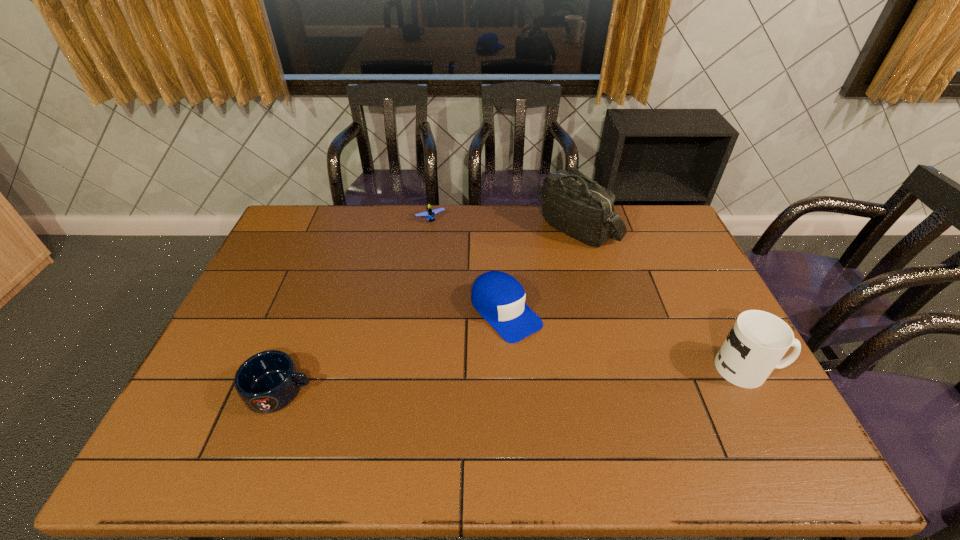
The image size is (960, 540). What are the coordinates of `shoulder bag at the far edge` in the screenshot? It's located at click(572, 203).

Locate an element on the screen. This screenshot has height=540, width=960. Lego at the far edge is located at coordinates (429, 214).

At what (x,y) coordinates should I click in order to perform the action: click on object at the near edge. Please return your answer as a coordinate pair (x, y). This screenshot has height=540, width=960. Looking at the image, I should click on (268, 381).

Identify the location of object that is positioned at the left edge. (268, 381).

You are a GUI agent. You are given a task and a screenshot of the screen. Output one action in this format:
    pyautogui.click(x=<x>, y=<y>)
    Task: Click on the object at the right edge
    The image size is (960, 540).
    Given the screenshot: What is the action you would take?
    pyautogui.click(x=758, y=340)

I want to click on object at the near left corner, so click(268, 381).

Find the location of a particular element. vacant space at the far edge of the desktop is located at coordinates (448, 215).

This screenshot has width=960, height=540. I want to click on free region at the near edge of the desktop, so click(x=468, y=406).

In the image, there is a desktop. Identify the location of vacant space at the right edge. This screenshot has height=540, width=960. (703, 353).

Find the location of a particular element. vacant space at the near left corner of the desktop is located at coordinates (210, 394).